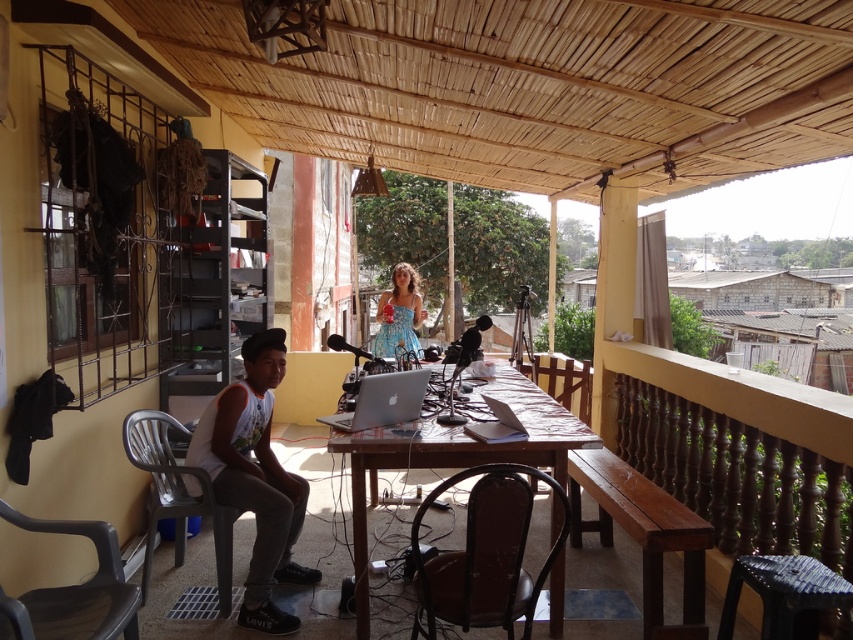
You are setting up a video call and need to place your silver metallic laptop at center on the wooden table at center. Will there be enough space for the laptop?

The wooden table at center has a larger size compared to silver metallic laptop at center, so yes, there will be enough space for the laptop.

You are organizing a small outdoor event and need to seat guests. You have a white plastic chair at lower left and a blue printed dress at center. Which object can accommodate more people?

The white plastic chair at lower left has a larger size compared to blue printed dress at center, so it can accommodate more people.